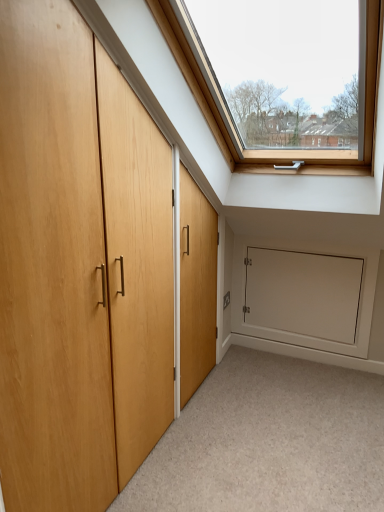
Locate an element on the screen. The width and height of the screenshot is (384, 512). free space above white matte door at lower right (from a real-world perspective) is located at coordinates (321, 242).